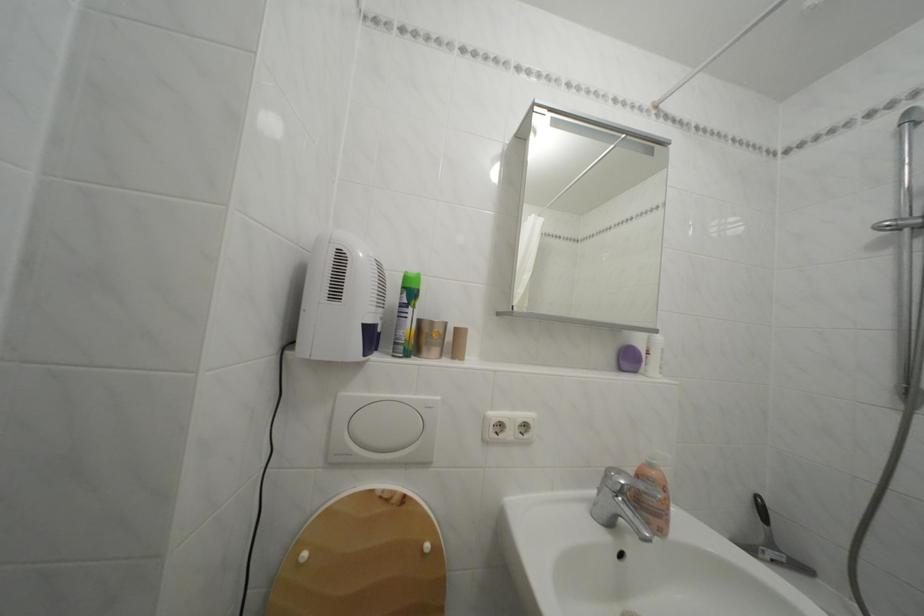
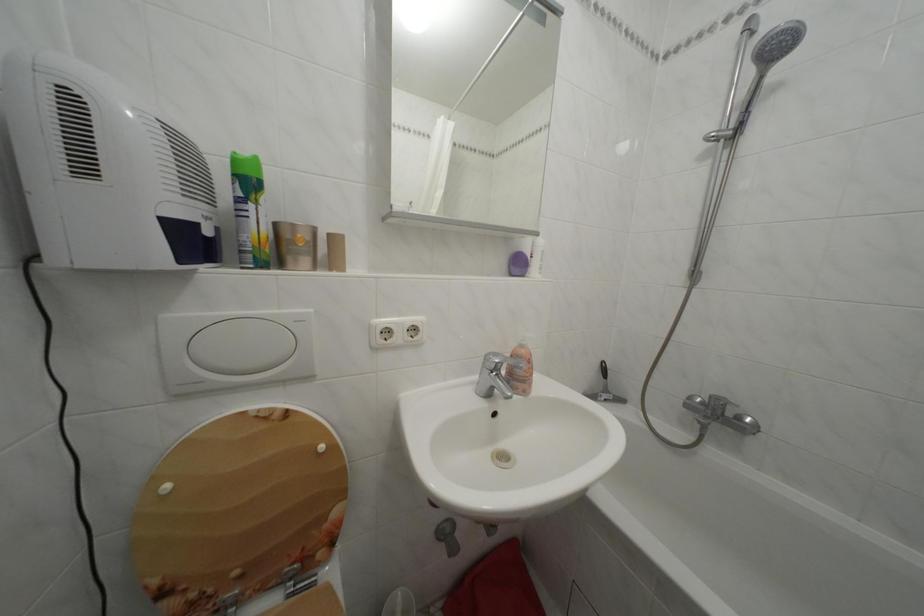
Locate, in the second image, the point that corresponds to point (638, 365) in the first image.

(527, 270)